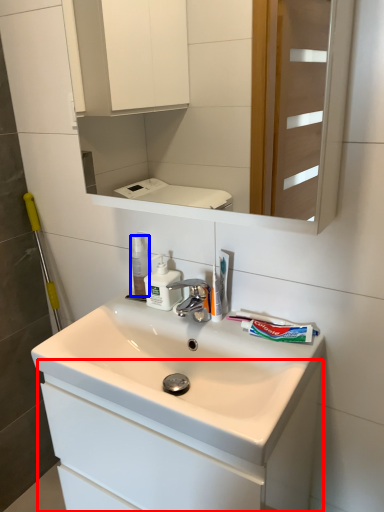
Question: Among these objects, which one is farthest to the camera, bathroom cabinet (highlighted by a red box) or mouthwash (highlighted by a blue box)?

Choices:
 (A) bathroom cabinet
 (B) mouthwash

Answer: (B)